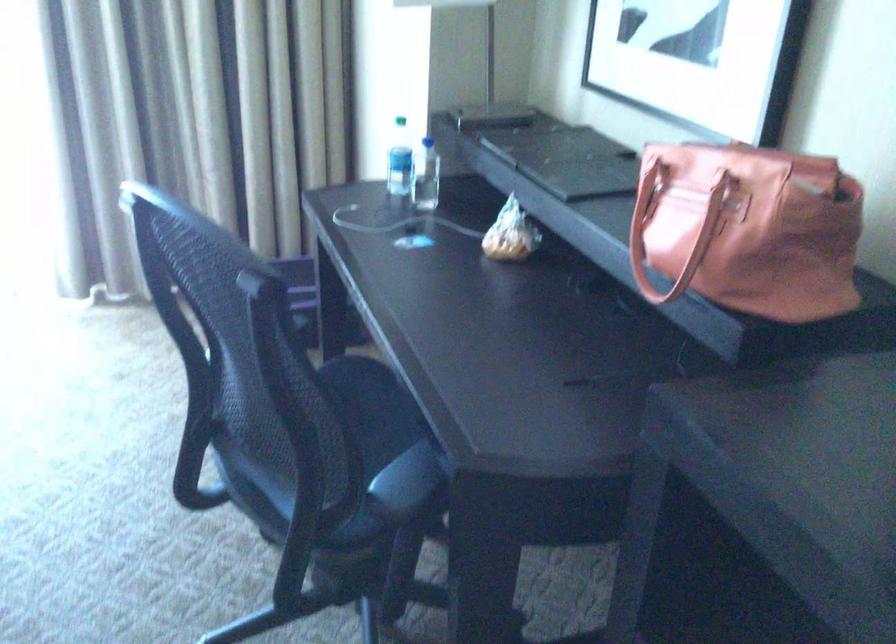
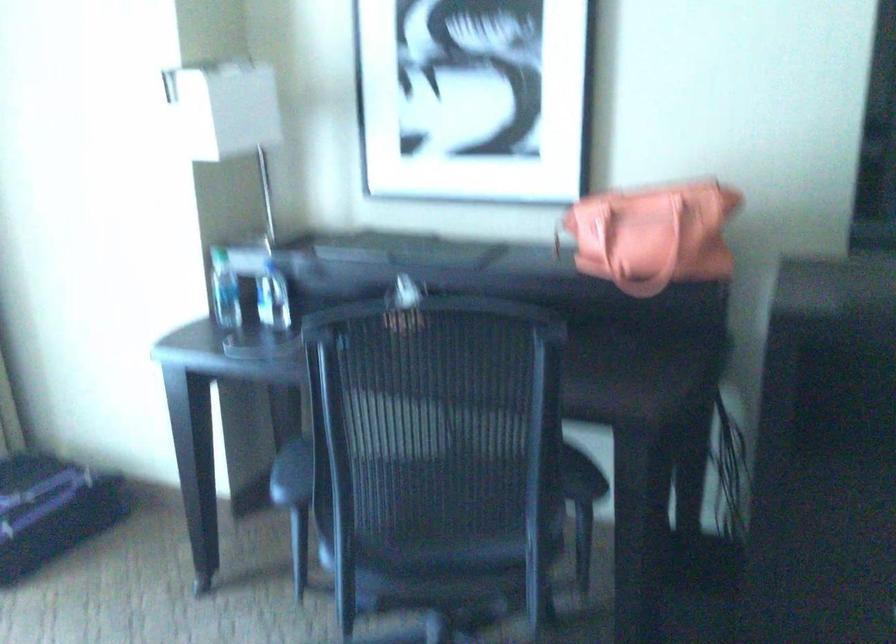
Find the pixel in the second image that matches the point at 668,231 in the first image.

(633, 238)